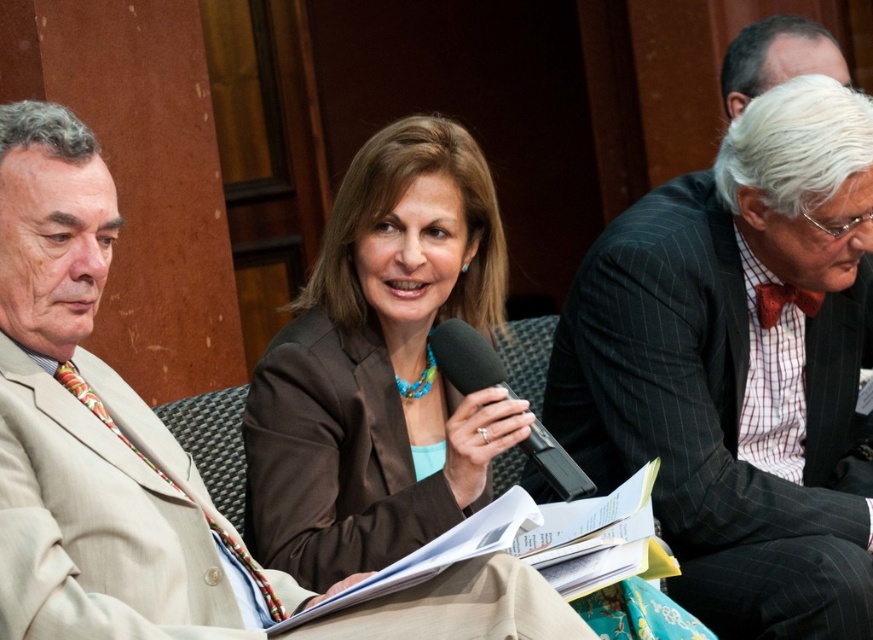
In the scene shown: Based on the scene description, where is the dark gray pinstripe suit at right located in the image?

The dark gray pinstripe suit at right is located at point 0.572 on the x axis and 0.847 on the y axis.

You are attending a formal event and notice two attendees wearing dark gray pinstripe suit at right and beige textured suit at left. Which one is taller?

The dark gray pinstripe suit at right is taller than the beige textured suit at left.